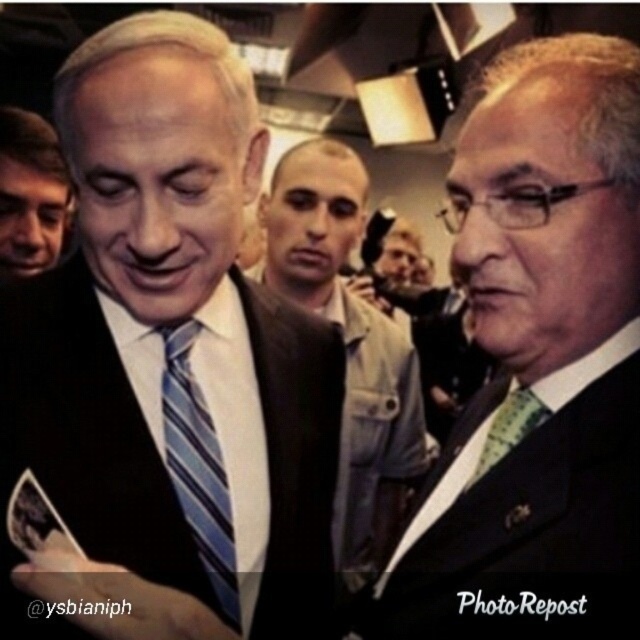
Who is positioned more to the right, matte black suit at center or blue striped tie at center?

blue striped tie at center

Does point (278, 336) come farther from viewer compared to point (189, 410)?

Yes, point (278, 336) is farther from viewer.

At what (x,y) coordinates should I click in order to perform the action: click on matte black suit at center. Please return your answer as a coordinate pair (x, y). Looking at the image, I should click on (164, 369).

Looking at this image, is matte black suit at left further to camera compared to green textured tie at right?

Yes, matte black suit at left is further from the viewer.

The image size is (640, 640). Identify the location of matte black suit at left. (29, 195).

Can you confirm if matte black suit at center is thinner than matte black suit at left?

No.

Is matte black suit at center wider than matte black suit at left?

Correct, the width of matte black suit at center exceeds that of matte black suit at left.

Describe the element at coordinates (164, 369) in the screenshot. I see `matte black suit at center` at that location.

You are a GUI agent. You are given a task and a screenshot of the screen. Output one action in this format:
    pyautogui.click(x=<x>, y=<y>)
    Task: Click on the matte black suit at center
    Image resolution: width=640 pixels, height=640 pixels.
    Given the screenshot: What is the action you would take?
    pyautogui.click(x=164, y=369)